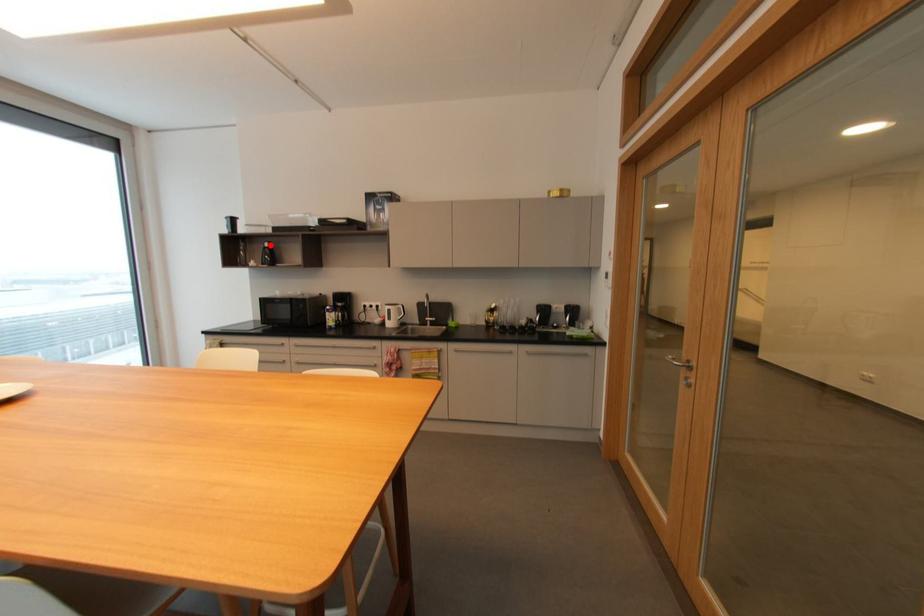
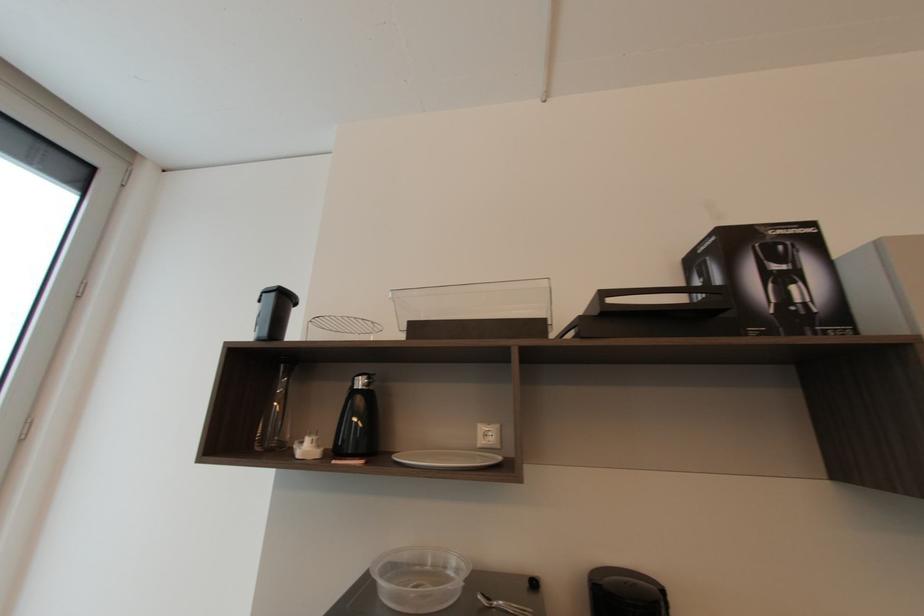
The point at the highlighted location is marked in the first image. Where is the corresponding point in the second image?

(362, 384)